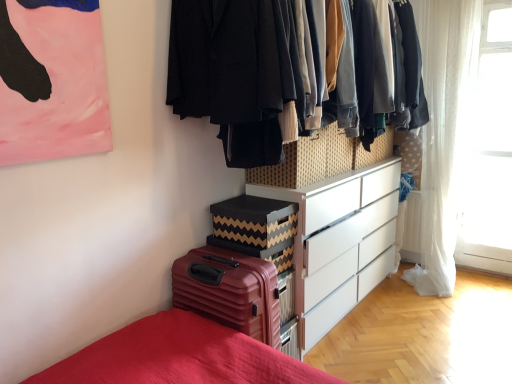
Question: Can you confirm if woven fabric drawer at center is wider than white sheer curtain at right?

Choices:
 (A) yes
 (B) no

Answer: (A)

Question: Are woven fabric drawer at center and white sheer curtain at right far apart?

Choices:
 (A) no
 (B) yes

Answer: (B)

Question: Is woven fabric drawer at center completely or partially outside of white sheer curtain at right?

Choices:
 (A) no
 (B) yes

Answer: (B)

Question: From the image's perspective, is woven fabric drawer at center beneath white sheer curtain at right?

Choices:
 (A) yes
 (B) no

Answer: (A)

Question: Is woven fabric drawer at center with white sheer curtain at right?

Choices:
 (A) yes
 (B) no

Answer: (B)

Question: Considering their positions, is white matte chest of drawers at center located in front of or behind white sheer curtain at right?

Choices:
 (A) front
 (B) behind

Answer: (A)

Question: Considering the positions of white matte chest of drawers at center and white sheer curtain at right in the image, is white matte chest of drawers at center taller or shorter than white sheer curtain at right?

Choices:
 (A) short
 (B) tall

Answer: (A)

Question: Is white matte chest of drawers at center bigger or smaller than white sheer curtain at right?

Choices:
 (A) big
 (B) small

Answer: (A)

Question: From the image's perspective, is white matte chest of drawers at center above or below white sheer curtain at right?

Choices:
 (A) above
 (B) below

Answer: (B)

Question: From a real-world perspective, is white sheer curtain at right positioned above or below white matte chest of drawers at center?

Choices:
 (A) below
 (B) above

Answer: (B)

Question: Is white sheer curtain at right inside the boundaries of white matte chest of drawers at center, or outside?

Choices:
 (A) inside
 (B) outside

Answer: (B)

Question: Relative to white matte chest of drawers at center, is white sheer curtain at right in front or behind?

Choices:
 (A) front
 (B) behind

Answer: (B)

Question: Based on their sizes in the image, would you say white sheer curtain at right is bigger or smaller than white matte chest of drawers at center?

Choices:
 (A) big
 (B) small

Answer: (B)

Question: From the image's perspective, relative to white matte chest of drawers at center, is matte brown suitcase at lower left above or below?

Choices:
 (A) below
 (B) above

Answer: (A)

Question: Is matte brown suitcase at lower left situated inside white matte chest of drawers at center or outside?

Choices:
 (A) inside
 (B) outside

Answer: (B)